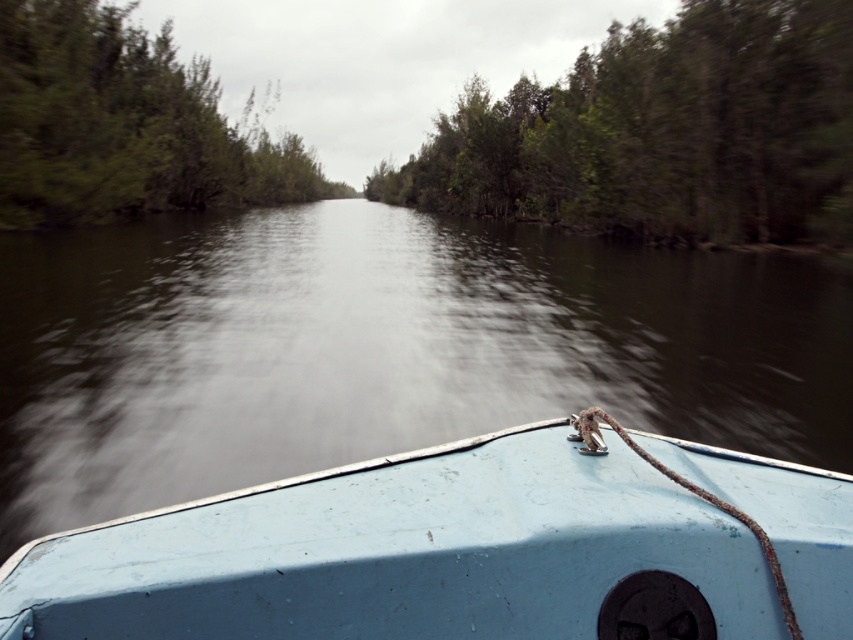
Does dark water at center have a larger size compared to light blue matte boat at center?

Indeed, dark water at center has a larger size compared to light blue matte boat at center.

Is point (193, 465) behind point (770, 460)?

Yes, it is behind point (770, 460).

This screenshot has height=640, width=853. I want to click on dark water at center, so click(381, 349).

Is light blue matte boat at center positioned in front of green leafy trees at upper center?

Yes, it is.

Is light blue matte boat at center thinner than green leafy trees at upper center?

Correct, light blue matte boat at center's width is less than green leafy trees at upper center's.

You are a GUI agent. You are given a task and a screenshot of the screen. Output one action in this format:
    pyautogui.click(x=<x>, y=<y>)
    Task: Click on the light blue matte boat at center
    The width and height of the screenshot is (853, 640).
    Given the screenshot: What is the action you would take?
    pyautogui.click(x=466, y=548)

You are a GUI agent. You are given a task and a screenshot of the screen. Output one action in this format:
    pyautogui.click(x=<x>, y=<y>)
    Task: Click on the light blue matte boat at center
    This screenshot has height=640, width=853.
    Given the screenshot: What is the action you would take?
    pyautogui.click(x=466, y=548)

Is light blue matte boat at center below green leafy trees at left?

Indeed, light blue matte boat at center is positioned under green leafy trees at left.

Can you confirm if light blue matte boat at center is wider than green leafy trees at left?

No.

Is point (753, 545) positioned in front of point (173, 132)?

Yes, it is in front of point (173, 132).

Identify the location of light blue matte boat at center. (466, 548).